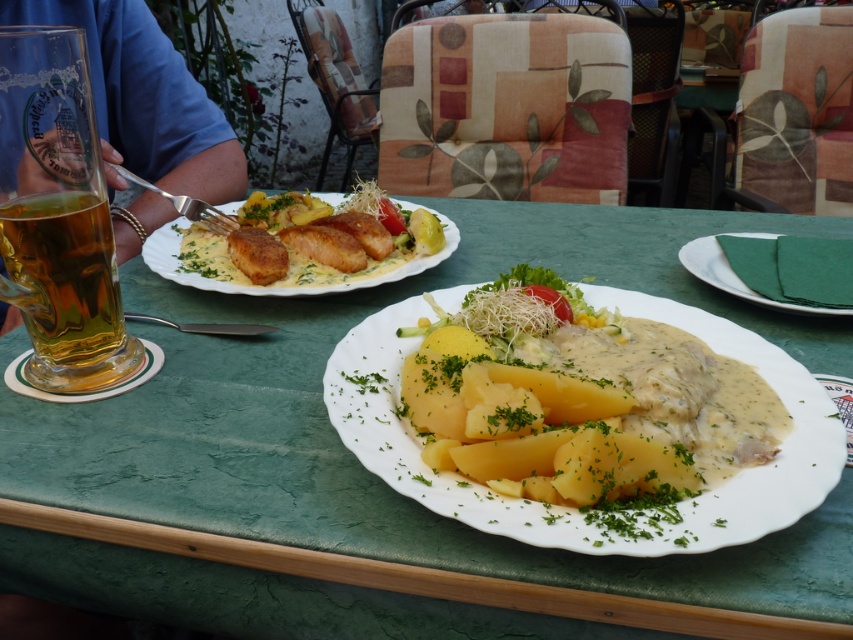
You are a server at the outdoor restaurant and need to deliver a dessert to the customer whose meal is shown in the image. The dessert must be placed between the translucent glass beer at left and the plate closest to the viewer. Is there enough space to place the dessert between them?

The translucent glass beer at left and the plate closest to the viewer are 16.20 inches apart, so there is sufficient space to place the dessert between them.

In the scene shown: You are a waiter at the outdoor restaurant. You need to place a new menu on the table. The menu is 10 cm wide. There is space between the translucent glass beer at left and the green paper napkin at right. Can you fit the menu there?

The translucent glass beer at left is positioned under the green paper napkin at right, meaning there is space between them. Since the menu is 10 cm wide and the space between the objects allows for placement, the menu can be placed there.

You are a food critic sitting at the table. You want to take a bite of the green leafy vegetable at center. Which direction should you move your hand from the yellow matte potatoes at center to reach it?

The green leafy vegetable at center is behind the yellow matte potatoes at center, so you should move your hand backward from the yellow matte potatoes at center to reach it.